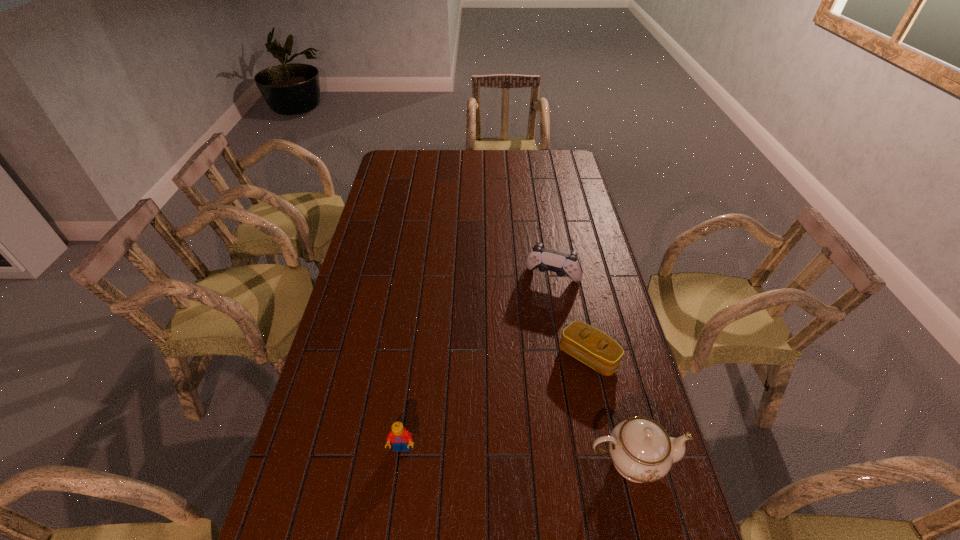
Where is `vacant space situated on the zipper side of the shortest object`? vacant space situated on the zipper side of the shortest object is located at coordinates (539, 407).

Find the location of a particular element. The width and height of the screenshot is (960, 540). vacant space positioned 0.330m on the zipper side of the shortest object is located at coordinates (493, 453).

Find the location of a particular element. vacant space located on the zipper side of the shortest object is located at coordinates (554, 391).

Where is `chinaware present at the right edge`? Image resolution: width=960 pixels, height=540 pixels. chinaware present at the right edge is located at coordinates (641, 450).

At what (x,y) coordinates should I click in order to perform the action: click on control present at the right edge. Please return your answer as a coordinate pair (x, y). Looking at the image, I should click on (563, 264).

Find the location of a particular element. Image resolution: width=960 pixels, height=540 pixels. clutch bag positioned at the right edge is located at coordinates (584, 342).

Locate an element on the screen. The image size is (960, 540). vacant space at the far edge is located at coordinates (429, 170).

In the image, there is a desktop. Where is `vacant region at the near edge`? The height and width of the screenshot is (540, 960). vacant region at the near edge is located at coordinates (436, 524).

You are a GUI agent. You are given a task and a screenshot of the screen. Output one action in this format:
    pyautogui.click(x=<x>, y=<y>)
    Task: Click on the vacant space at the left edge of the desktop
    This screenshot has height=540, width=960.
    Given the screenshot: What is the action you would take?
    pyautogui.click(x=364, y=330)

Where is `free spot at the right edge of the desktop`? Image resolution: width=960 pixels, height=540 pixels. free spot at the right edge of the desktop is located at coordinates (588, 282).